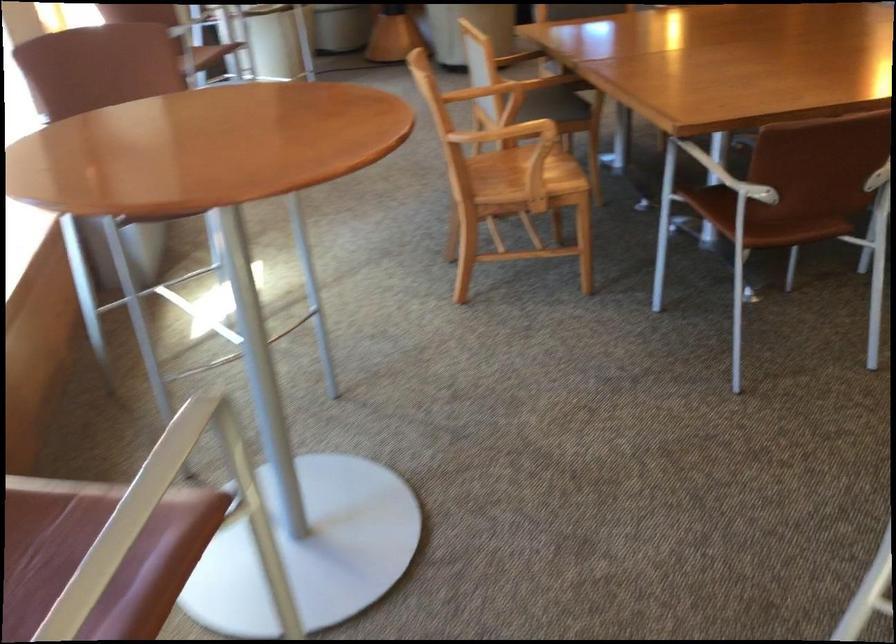
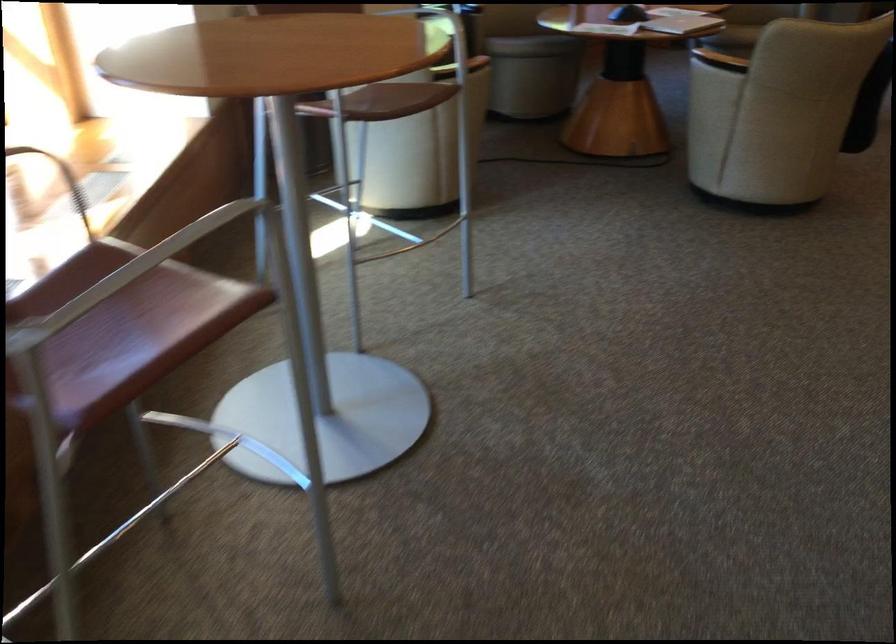
Question: The images are taken continuously from a first-person perspective. In which direction are you moving?

Choices:
 (A) Left
 (B) Right
 (C) Forward
 (D) Backward

Answer: (C)